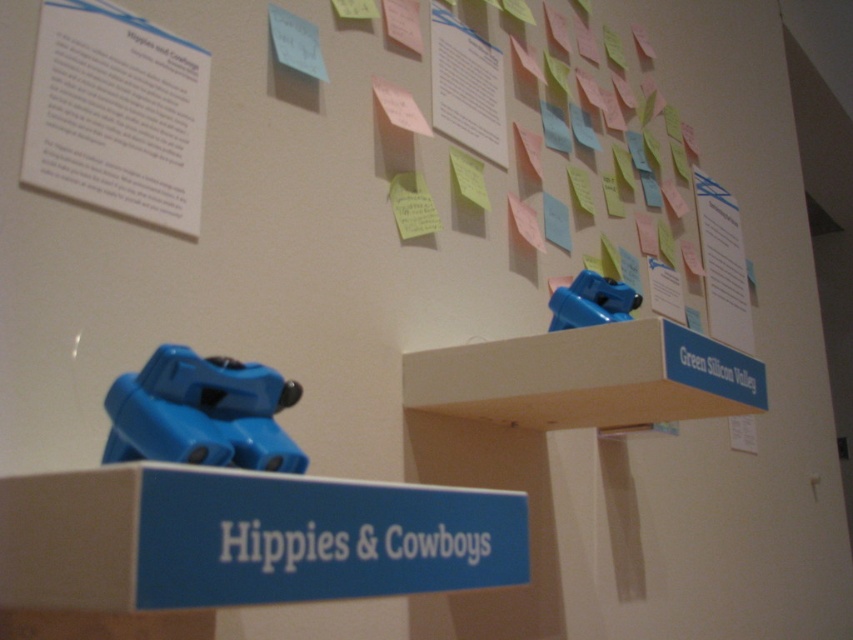
You are an artist setting up an exhibition. You have a large sculpture that needs to be placed on either the white wood shelf at upper center or the green matte sign at upper right. Based on the scene description, which object can support the sculpture?

The white wood shelf at upper center is larger in size than the green matte sign at upper right, so it can support the sculpture better.

You are an artist setting up an exhibit. You need to place a 4.5 inch wide decorative plate between the white wood shelf at upper center and the green matte sign at upper right. Can it fit without overlapping either object?

The white wood shelf at upper center and green matte sign at upper right are 4.68 inches apart. Since the decorative plate is 4.5 inches wide, it can fit between them without overlapping as there is enough space.

You are an artist planning to hang two signs in your studio. The white matte sign at center and the green matte sign at upper right. Given that you have a limited wall space that can only accommodate a sign wider than the other, which sign should you choose to fit the space?

The green matte sign at upper right is wider than the white matte sign at center, so you should choose the green matte sign at upper right to fit the wall space.